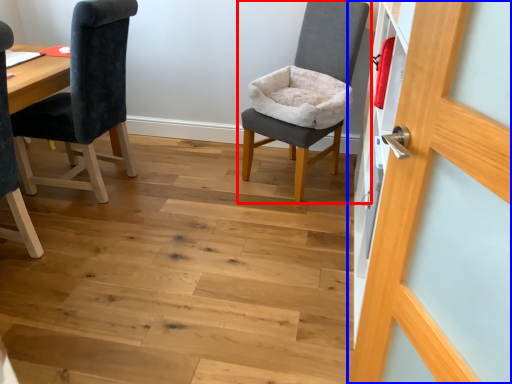
Question: Which point is closer to the camera, chair (highlighted by a red box) or door (highlighted by a blue box)?

Choices:
 (A) chair
 (B) door

Answer: (B)